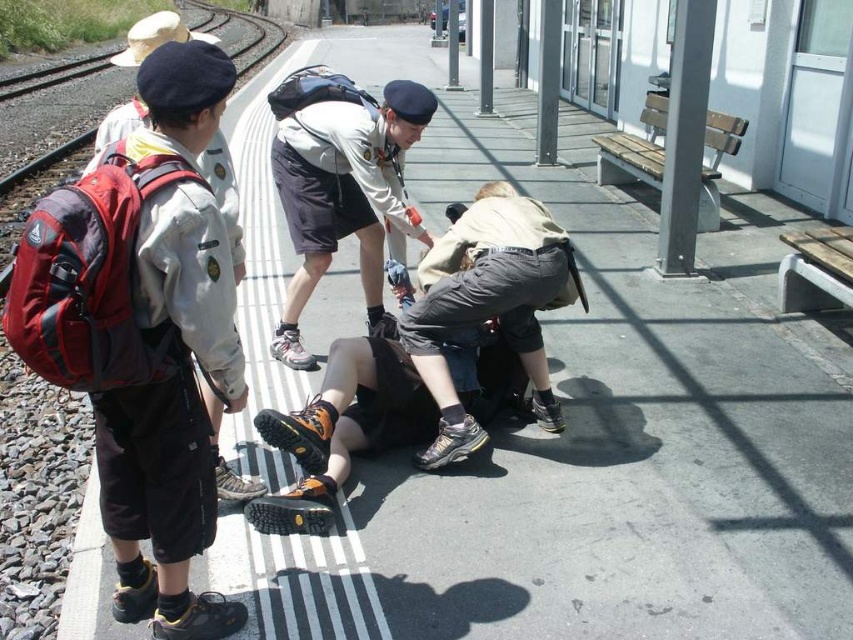
Does light gray uniform at center have a lesser width compared to matte gray uniform at left?

Indeed, light gray uniform at center has a lesser width compared to matte gray uniform at left.

Is point (280, 356) less distant than point (107, 113)?

Yes, it is in front of point (107, 113).

This screenshot has height=640, width=853. Identify the location of light gray uniform at center. (341, 182).

From the picture: How distant is light gray uniform at center from khaki cotton shirt at center?

light gray uniform at center and khaki cotton shirt at center are 26.40 inches apart.

Is light gray uniform at center positioned in front of khaki cotton shirt at center?

No, light gray uniform at center is behind khaki cotton shirt at center.

Is point (363, 109) in front of point (421, 464)?

No, it is behind (421, 464).

Where is `light gray uniform at center`? The height and width of the screenshot is (640, 853). light gray uniform at center is located at coordinates (341, 182).

Does point (485, 200) lie behind point (136, 56)?

Yes, point (485, 200) is behind point (136, 56).

Which is above, khaki cotton shirt at center or matte gray uniform at left?

matte gray uniform at left

Where is `khaki cotton shirt at center`? The height and width of the screenshot is (640, 853). khaki cotton shirt at center is located at coordinates (488, 305).

This screenshot has height=640, width=853. I want to click on khaki cotton shirt at center, so click(x=488, y=305).